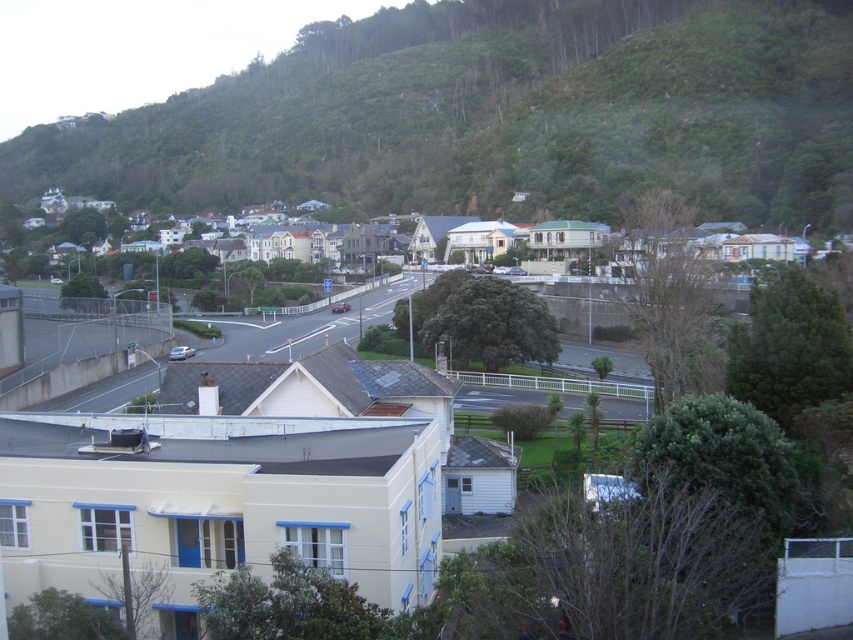
Question: Among these objects, which one is nearest to the camera?

Choices:
 (A) white painted houses at center
 (B) green leafy hillside at upper center

Answer: (A)

Question: Does green leafy hillside at upper center appear on the left side of white painted houses at center?

Choices:
 (A) yes
 (B) no

Answer: (B)

Question: Is green leafy hillside at upper center bigger than white painted houses at center?

Choices:
 (A) no
 (B) yes

Answer: (B)

Question: Can you confirm if green leafy hillside at upper center is smaller than white painted houses at center?

Choices:
 (A) yes
 (B) no

Answer: (B)

Question: Which point is farther to the camera?

Choices:
 (A) green leafy hillside at upper center
 (B) white painted houses at center

Answer: (A)